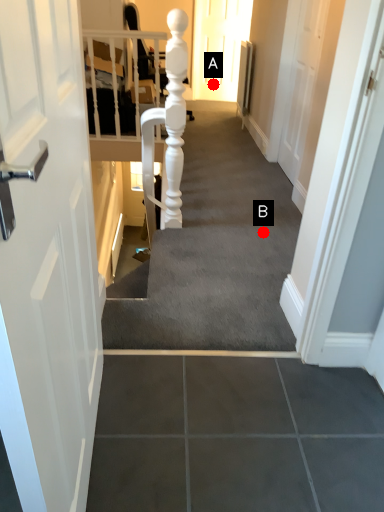
Question: Two points are circled on the image, labeled by A and B beside each circle. Which point is closer to the camera?

Choices:
 (A) A is closer
 (B) B is closer

Answer: (B)